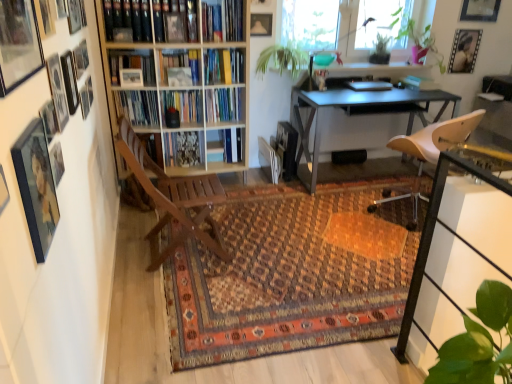
Where is `vacant space underneath patterned carpet at center (from a real-world perspective)`? This screenshot has width=512, height=384. vacant space underneath patterned carpet at center (from a real-world perspective) is located at coordinates (307, 246).